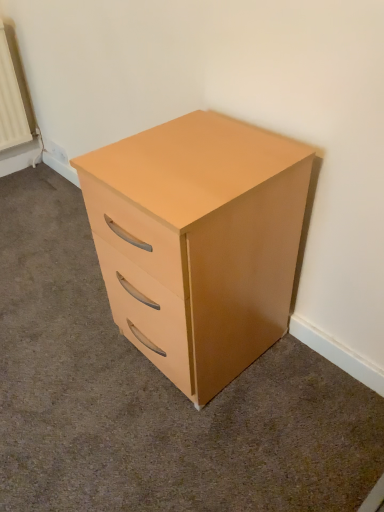
Find the location of a particular element. free space in front of matte wood chest of drawers at center is located at coordinates (203, 443).